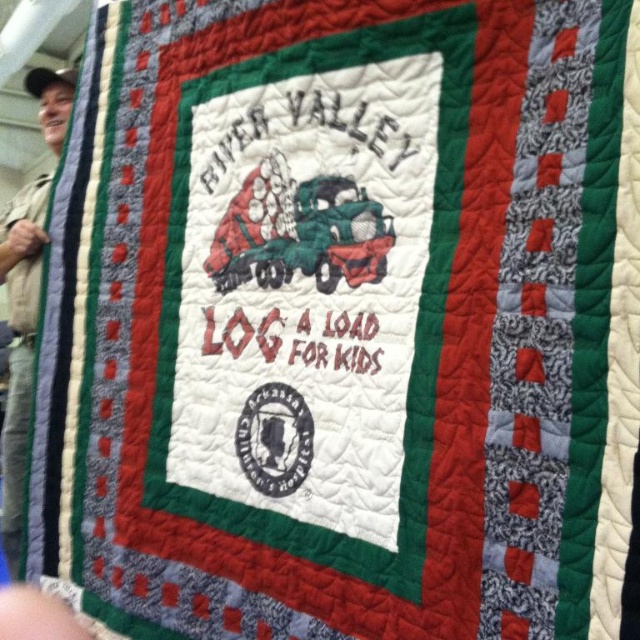
Which is in front, point (384, 228) or point (54, 109)?

Positioned in front is point (384, 228).

Does green matte truck at center appear under brown fabric shirt at left?

No.

Identify the location of green matte truck at center. (300, 234).